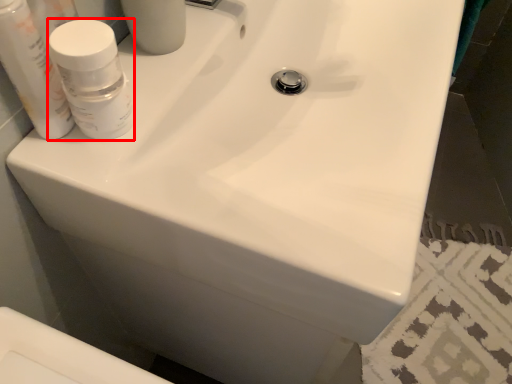
Question: From the image, what is the correct spatial relationship of mouthwash (annotated by the red box) in relation to mouthwash?

Choices:
 (A) right
 (B) left

Answer: (A)